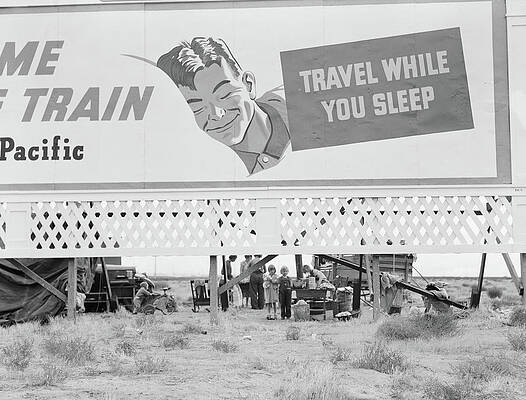
Where is `chair`? The image size is (526, 400). chair is located at coordinates (201, 295).